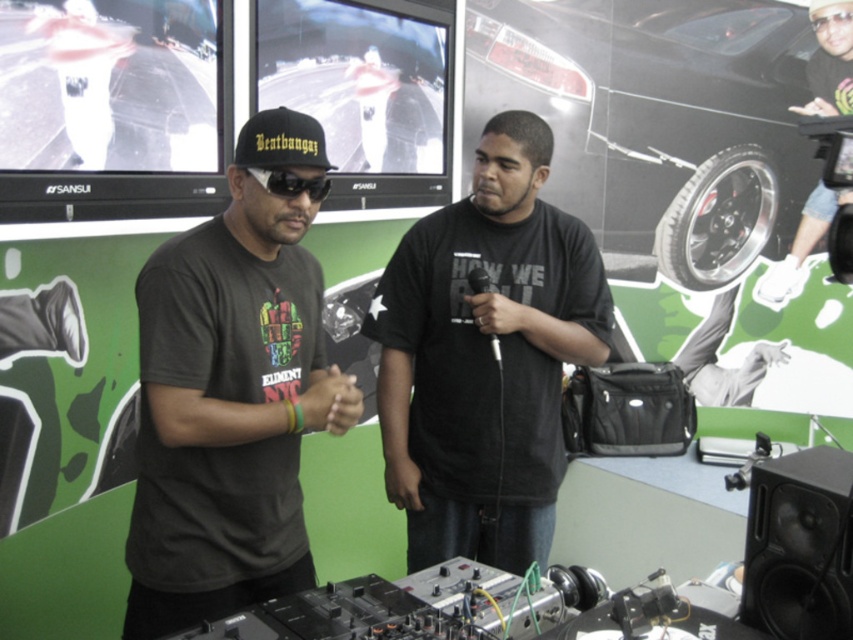
What is located at the coordinates point (485, 355) in the image?

The black matte shirt at center is located at point (485, 355).